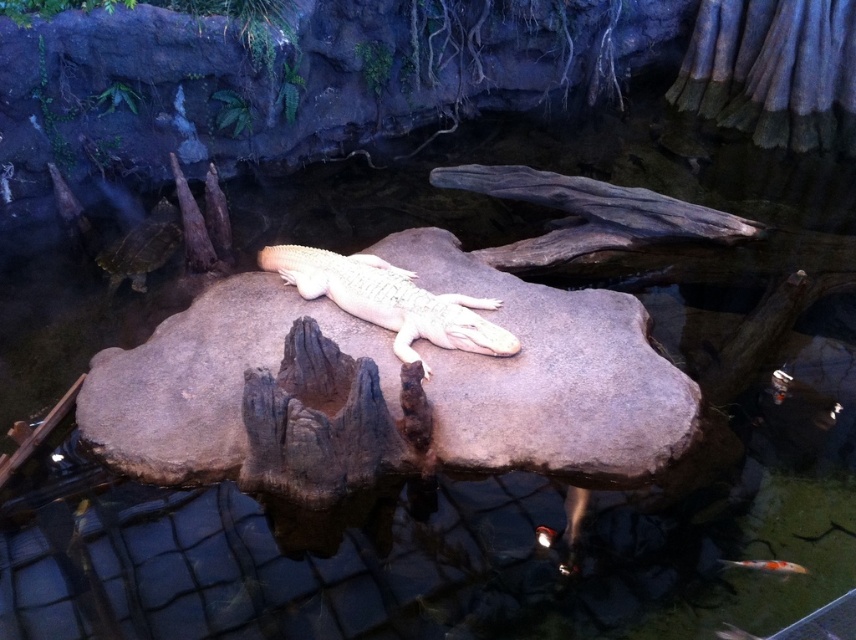
Question: Which point is closer to the camera taking this photo?

Choices:
 (A) (343, 269)
 (B) (590, 449)

Answer: (B)

Question: Can you confirm if smooth gray rock at center is smaller than smooth cream-colored crocodile at center?

Choices:
 (A) no
 (B) yes

Answer: (A)

Question: In this image, where is smooth gray rock at center located relative to smooth cream-colored crocodile at center?

Choices:
 (A) below
 (B) above

Answer: (A)

Question: Which point is farther from the camera taking this photo?

Choices:
 (A) (456, 323)
 (B) (623, 397)

Answer: (A)

Question: Does smooth gray rock at center have a smaller size compared to smooth cream-colored crocodile at center?

Choices:
 (A) no
 (B) yes

Answer: (A)